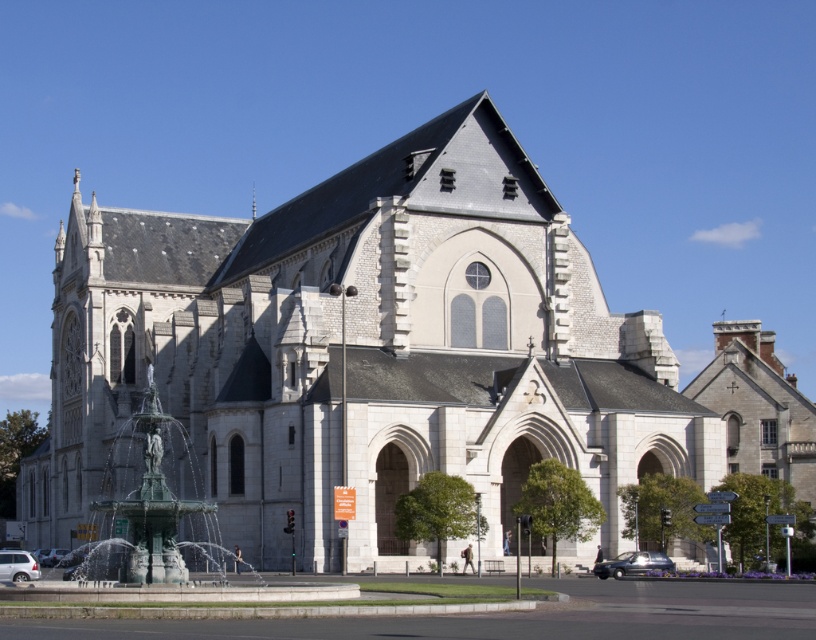
Question: Which of the following is the closest to the observer?

Choices:
 (A) (601, 570)
 (B) (205, 518)
 (C) (38, 557)
 (D) (273, 490)

Answer: (A)

Question: Can you confirm if shiny black sedan at lower right is positioned to the left of silver metallic car at lower left?

Choices:
 (A) yes
 (B) no

Answer: (B)

Question: Is white stone church at center below metallic silver car at lower left?

Choices:
 (A) yes
 (B) no

Answer: (B)

Question: Is green patinated bronze fountain at lower left bigger than silver metallic car at lower left?

Choices:
 (A) no
 (B) yes

Answer: (B)

Question: Which object is farther from the camera taking this photo?

Choices:
 (A) white stone church at center
 (B) silver metallic car at lower left
 (C) metallic silver car at lower left

Answer: (C)

Question: Which point appears closest to the camera in this image?

Choices:
 (A) (131, 448)
 (B) (43, 564)

Answer: (B)